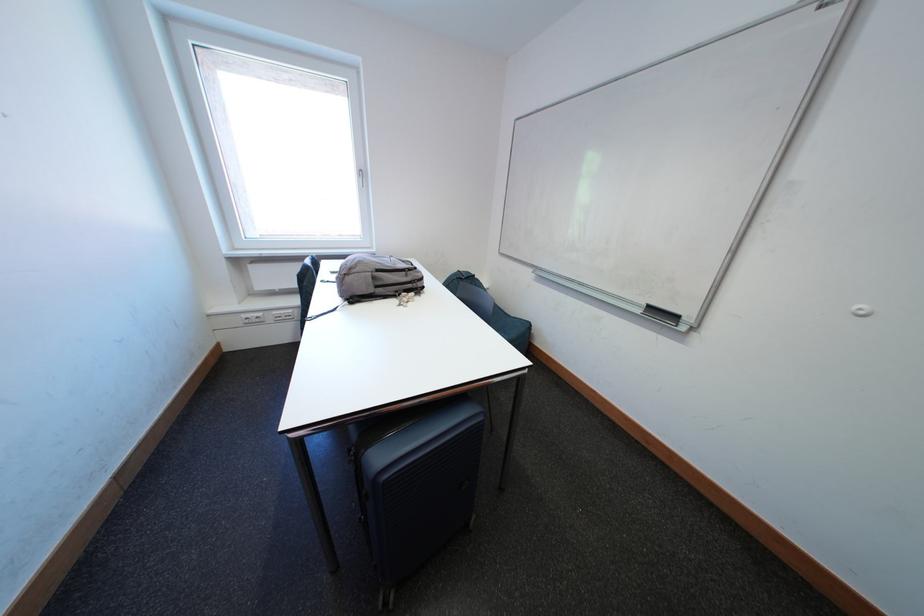
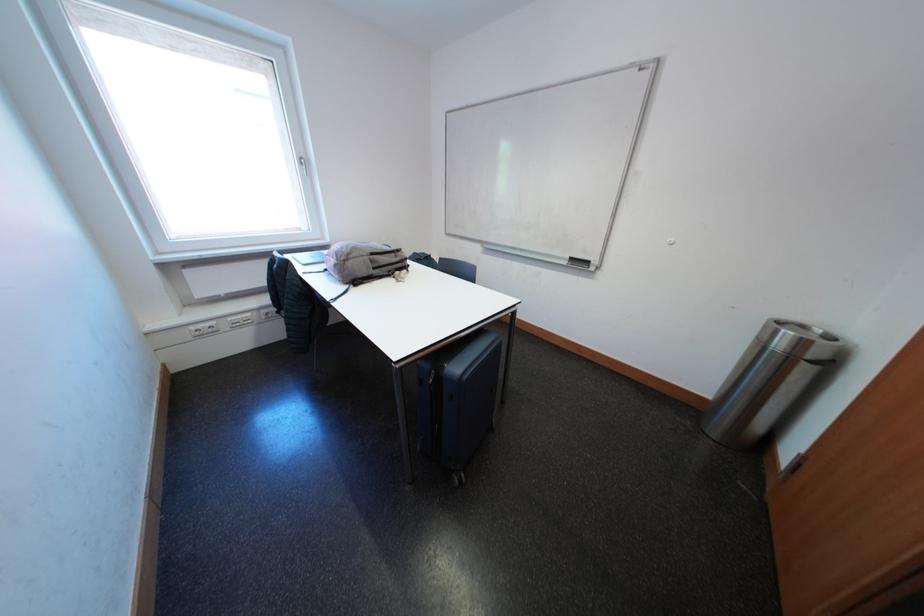
Where in the second image is the point corresponding to point (371, 175) from the first image?

(311, 163)